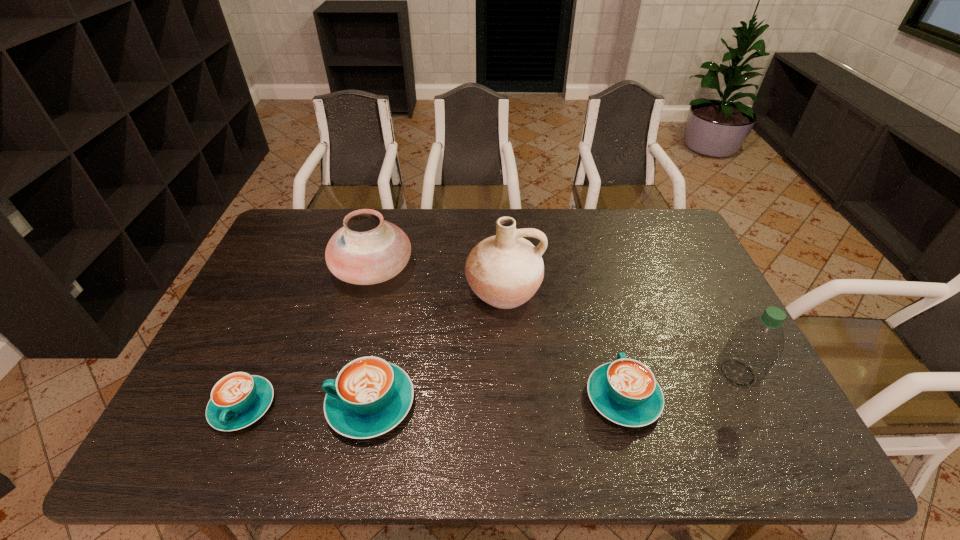
At what (x,y) coordinates should I click in order to perform the action: click on the shortest cappuccino. Please return your answer as a coordinate pair (x, y). This screenshot has width=960, height=540. Looking at the image, I should click on (239, 399).

At what (x,y) coordinates should I click in order to perform the action: click on the leftmost object. Please return your answer as a coordinate pair (x, y). Looking at the image, I should click on (239, 399).

This screenshot has width=960, height=540. Find the location of `the second cappuccino from right to left`. the second cappuccino from right to left is located at coordinates (370, 396).

Locate an element on the screen. This screenshot has height=540, width=960. the second tallest cappuccino is located at coordinates (625, 391).

In order to click on the second shortest object in this screenshot , I will do `click(625, 391)`.

You are a GUI agent. You are given a task and a screenshot of the screen. Output one action in this format:
    pyautogui.click(x=<x>, y=<y>)
    Task: Click on the left pottery
    
    Given the screenshot: What is the action you would take?
    pyautogui.click(x=367, y=250)

Find the location of a particular element. the third object from right to left is located at coordinates (505, 271).

Where is `the right pottery`? the right pottery is located at coordinates (505, 271).

Identify the location of water bottle. (754, 346).

Find the location of a particular element. Image resolution: width=960 pixels, height=540 pixels. free region located with the handle on the right side of the second cappuccino from left to right is located at coordinates (299, 403).